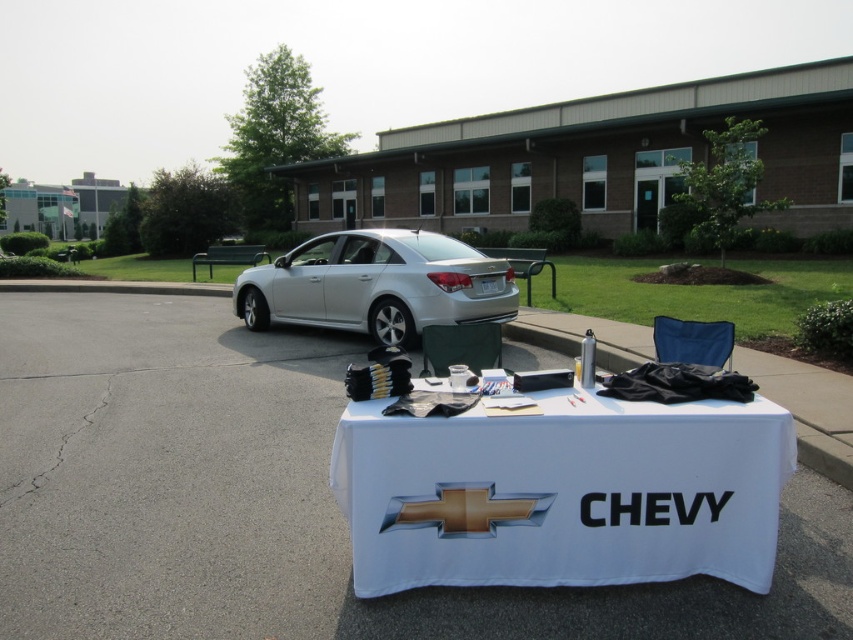
Question: Which point appears closest to the camera in this image?

Choices:
 (A) (552, 576)
 (B) (326, 273)

Answer: (A)

Question: Which point appears farthest from the camera in this image?

Choices:
 (A) [460, 300]
 (B) [407, 444]

Answer: (A)

Question: Is white fabric table at center to the left of silver metallic sedan at center from the viewer's perspective?

Choices:
 (A) yes
 (B) no

Answer: (B)

Question: Does white fabric table at center appear on the right side of silver metallic sedan at center?

Choices:
 (A) no
 (B) yes

Answer: (B)

Question: Where is white fabric table at center located in relation to silver metallic sedan at center in the image?

Choices:
 (A) above
 (B) below

Answer: (B)